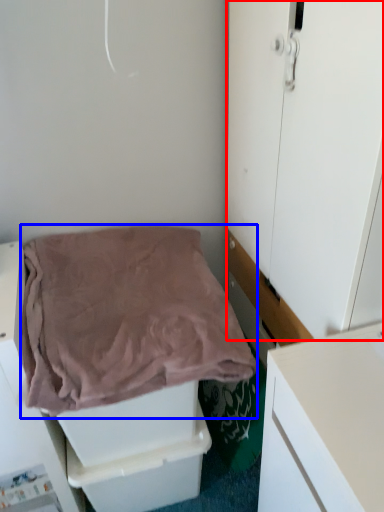
Question: Which of the following is the farthest to the observer, door (highlighted by a red box) or blanket (highlighted by a blue box)?

Choices:
 (A) door
 (B) blanket

Answer: (B)